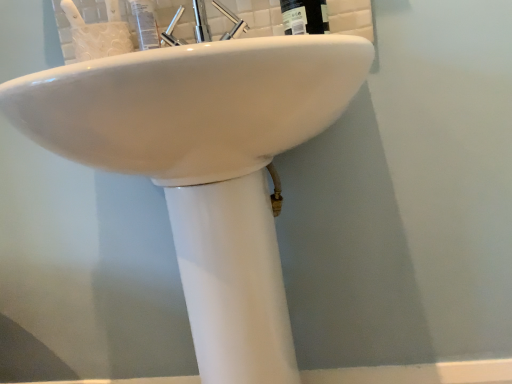
In order to face white glossy sink at center, should I rotate leftwards or rightwards?

Rotate your view left by about 5.077°.

The height and width of the screenshot is (384, 512). What do you see at coordinates (205, 165) in the screenshot? I see `white glossy sink at center` at bounding box center [205, 165].

Find the location of a particular element. This screenshot has width=512, height=384. white glossy sink at center is located at coordinates (205, 165).

Locate an element on the screen. white glossy sink at center is located at coordinates (205, 165).